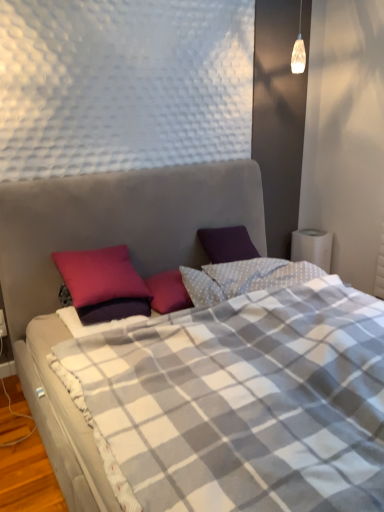
Question: Is purple matte pillow at upper left wider than plaid fabric bed at center?

Choices:
 (A) yes
 (B) no

Answer: (B)

Question: Considering the relative positions of purple matte pillow at upper left and plaid fabric bed at center in the image provided, is purple matte pillow at upper left to the left of plaid fabric bed at center from the viewer's perspective?

Choices:
 (A) yes
 (B) no

Answer: (A)

Question: Is purple matte pillow at upper left outside plaid fabric bed at center?

Choices:
 (A) yes
 (B) no

Answer: (B)

Question: Does purple matte pillow at upper left have a lesser height compared to plaid fabric bed at center?

Choices:
 (A) no
 (B) yes

Answer: (B)

Question: Does purple matte pillow at upper left have a larger size compared to plaid fabric bed at center?

Choices:
 (A) no
 (B) yes

Answer: (A)

Question: Considering the positions of point (77, 257) and point (1, 334), is point (77, 257) closer or farther from the camera than point (1, 334)?

Choices:
 (A) farther
 (B) closer

Answer: (B)

Question: From the image's perspective, is purple matte pillow at upper left above or below white plastic electric outlet at lower left?

Choices:
 (A) below
 (B) above

Answer: (B)

Question: From a real-world perspective, is purple matte pillow at upper left physically located above or below white plastic electric outlet at lower left?

Choices:
 (A) below
 (B) above

Answer: (B)

Question: Visually, is purple matte pillow at upper left positioned to the left or to the right of white plastic electric outlet at lower left?

Choices:
 (A) left
 (B) right

Answer: (B)

Question: In terms of width, does plaid fabric bed at center look wider or thinner when compared to white plastic electric outlet at lower left?

Choices:
 (A) wide
 (B) thin

Answer: (A)

Question: Considering the positions of plaid fabric bed at center and white plastic electric outlet at lower left in the image, is plaid fabric bed at center bigger or smaller than white plastic electric outlet at lower left?

Choices:
 (A) small
 (B) big

Answer: (B)

Question: Does point (160, 217) appear closer or farther from the camera than point (3, 316)?

Choices:
 (A) closer
 (B) farther

Answer: (B)

Question: From a real-world perspective, is plaid fabric bed at center positioned above or below white plastic electric outlet at lower left?

Choices:
 (A) below
 (B) above

Answer: (B)

Question: Looking at their shapes, would you say white plastic electric outlet at lower left is wider or thinner than purple matte pillow at upper left?

Choices:
 (A) wide
 (B) thin

Answer: (B)

Question: Does point (3, 326) appear closer or farther from the camera than point (87, 253)?

Choices:
 (A) closer
 (B) farther

Answer: (B)